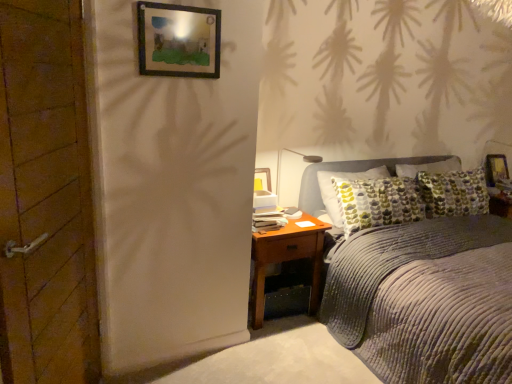
Question: In terms of width, does wooden picture frame at upper right, placed as the 1th picture frame when sorted from back to front, look wider or thinner when compared to brown wooden nightstand at lower right?

Choices:
 (A) thin
 (B) wide

Answer: (A)

Question: Considering the positions of wooden picture frame at upper right, placed as the 1th picture frame when sorted from back to front, and brown wooden nightstand at lower right in the image, is wooden picture frame at upper right, placed as the 1th picture frame when sorted from back to front, bigger or smaller than brown wooden nightstand at lower right?

Choices:
 (A) big
 (B) small

Answer: (B)

Question: Based on their relative distances, which object is farther from the wooden picture frame at upper right, the first picture frame positioned from the right?

Choices:
 (A) wooden door at left
 (B) brown wooden nightstand at lower right
 (C) white plastic lamp at center
 (D) wooden framed picture at upper center, arranged as the first picture frame when viewed from the top
 (E) corduroy gray bed at center

Answer: (A)

Question: Estimate the real-world distances between objects in this image. Which object is closer to the wooden door at left?

Choices:
 (A) wooden framed picture at upper center, which ranks as the first picture frame in front-to-back order
 (B) wooden picture frame at upper right, which ranks as the 2th picture frame in front-to-back order
 (C) corduroy gray bed at center
 (D) white plastic lamp at center
 (E) brown wooden nightstand at lower right

Answer: (A)